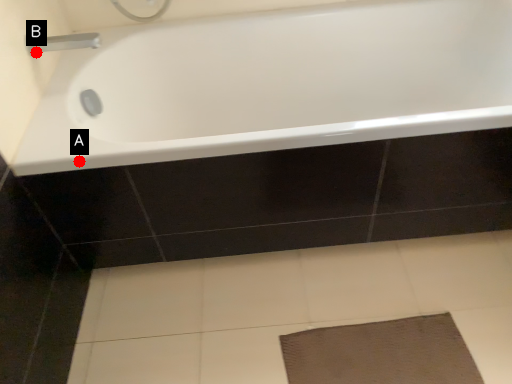
Question: Two points are circled on the image, labeled by A and B beside each circle. Which point is farther from the camera taking this photo?

Choices:
 (A) A is further
 (B) B is further

Answer: (B)